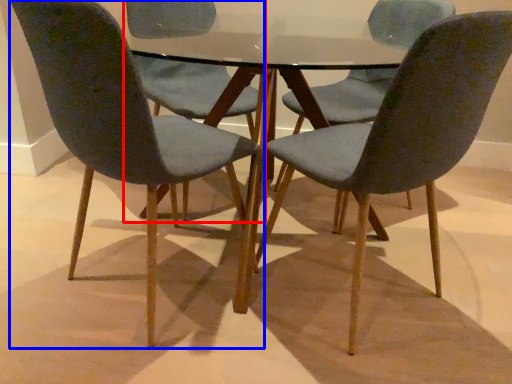
Question: Among these objects, which one is nearest to the camera, chair (highlighted by a red box) or chair (highlighted by a blue box)?

Choices:
 (A) chair
 (B) chair

Answer: (B)